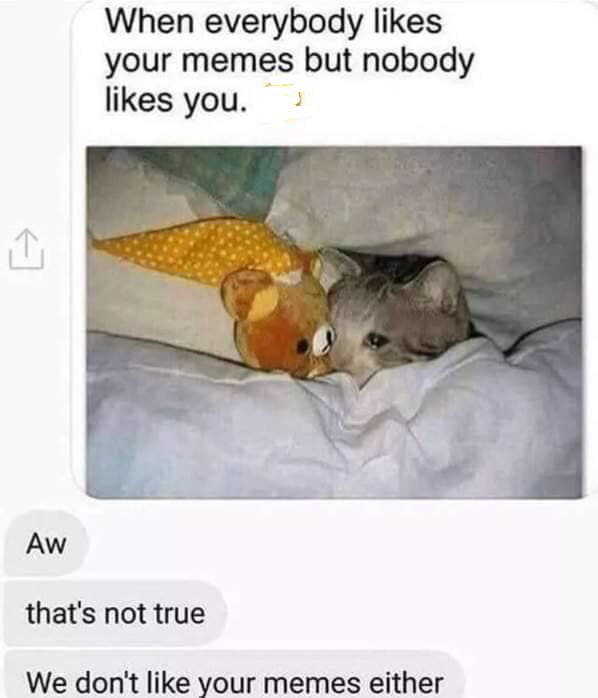
Where is `blanket`? The image size is (598, 698). blanket is located at coordinates click(350, 451).